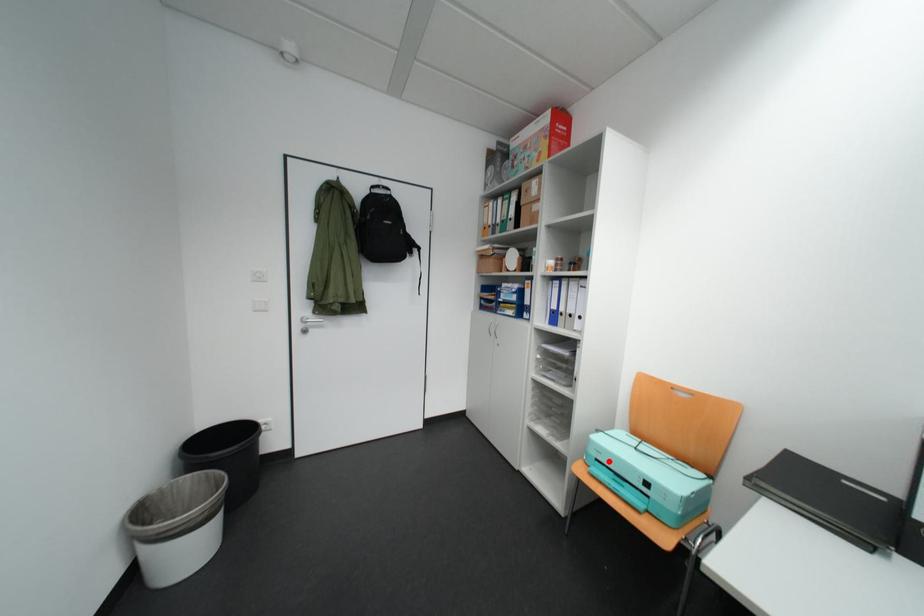
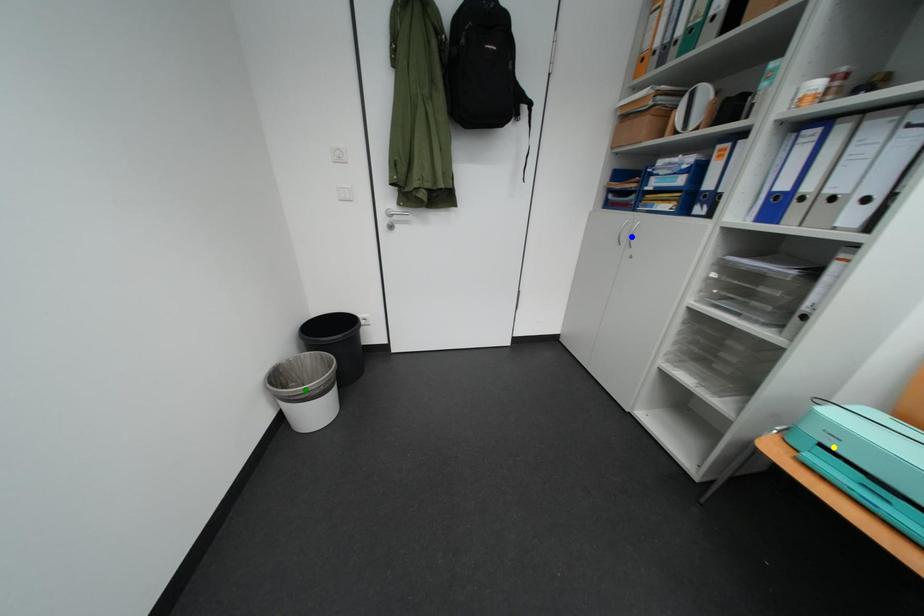
Question: I am providing you with two images of the same scene from different viewpoints. A red point is marked on the first image. You are given multiple points on the second image. In image 2, which mark is for the same physical point as the one in image 1?

Choices:
 (A) green point
 (B) blue point
 (C) yellow point

Answer: (C)